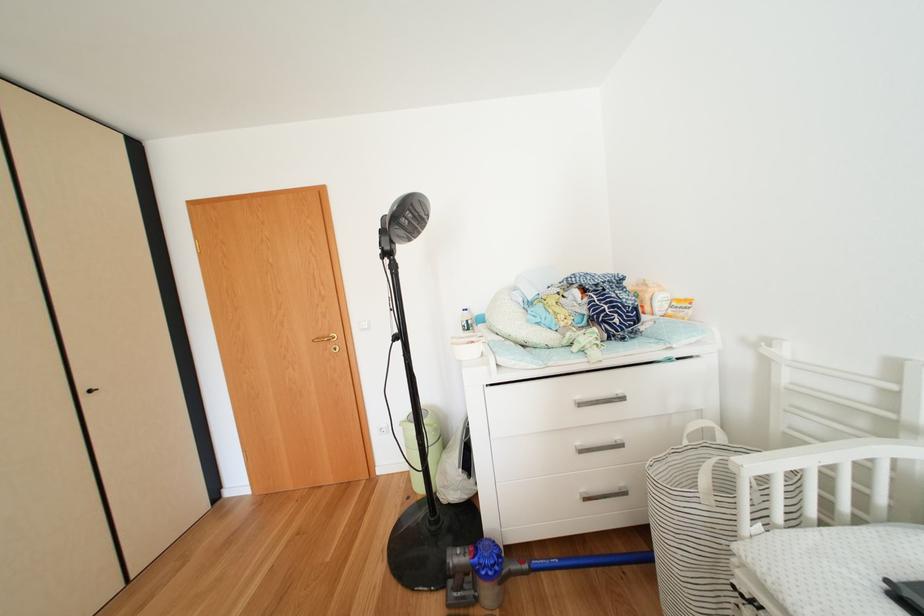
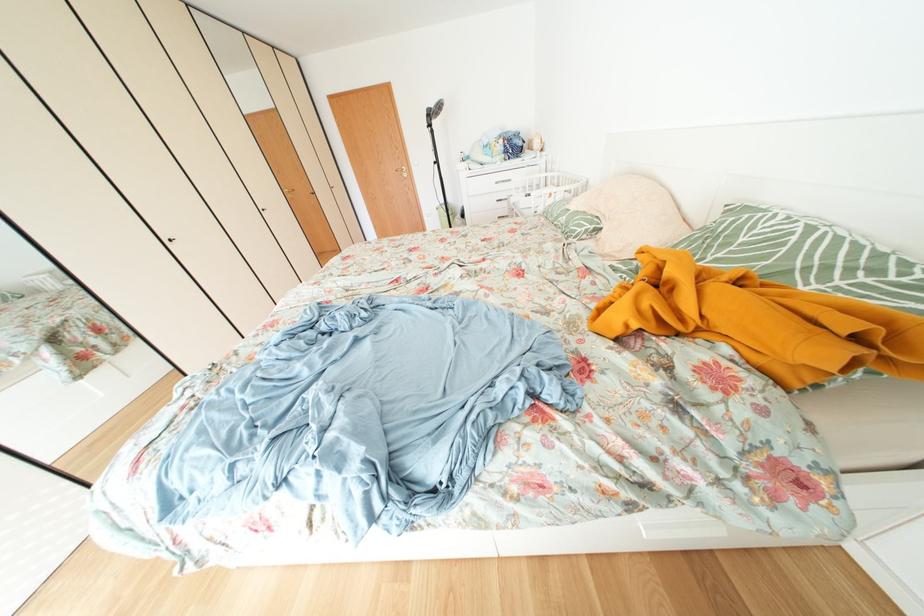
Question: Which direction would the cameraman need to move to produce the second image? Reply with the corresponding letter.

Choices:
 (A) Left
 (B) Right
 (C) Forward
 (D) Backward

Answer: (D)